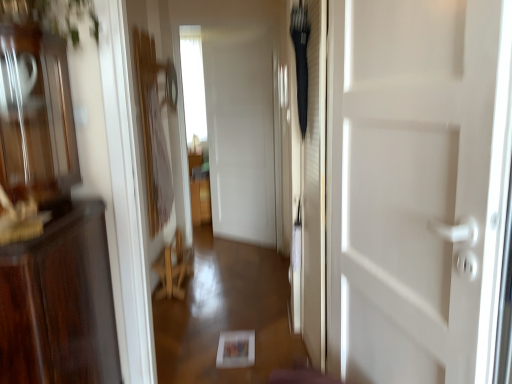
Question: Does point pos(488,175) appear closer or farther from the camera than point pos(188,33)?

Choices:
 (A) farther
 (B) closer

Answer: (B)

Question: Would you say white glossy door at center is to the left or to the right of transparent glass window at center in the picture?

Choices:
 (A) right
 (B) left

Answer: (A)

Question: Considering the real-world distances, which object is farthest from the wooden chair at center?

Choices:
 (A) white glossy door at center
 (B) transparent glass window at center

Answer: (B)

Question: Which is nearer to the wooden chair at center?

Choices:
 (A) transparent glass window at center
 (B) white glossy door at center

Answer: (B)